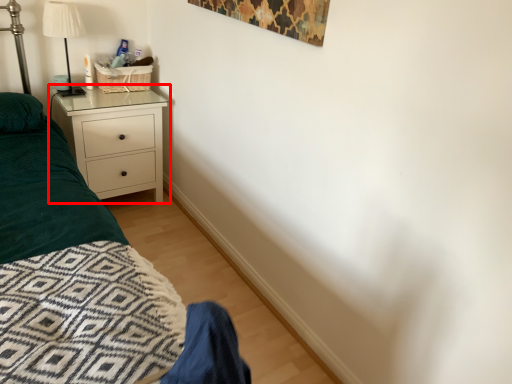
Question: Where is chest of drawers (annotated by the red box) located in relation to lamp in the image?

Choices:
 (A) left
 (B) right

Answer: (B)